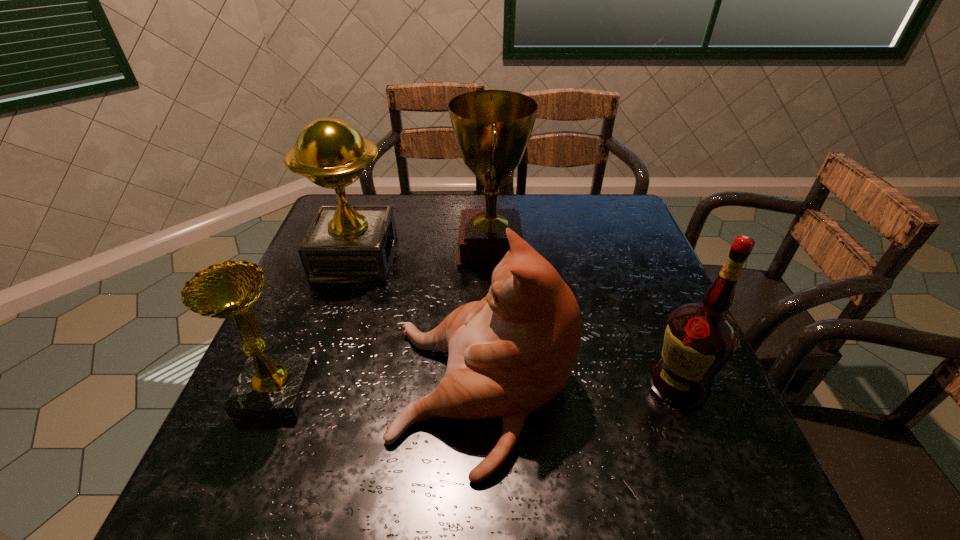
Locate an element on the screen. Image resolution: width=960 pixels, height=540 pixels. free space located on the label of the alcohol is located at coordinates (450, 384).

This screenshot has height=540, width=960. Find the location of `free space located on the face of the cat`. free space located on the face of the cat is located at coordinates (260, 395).

I want to click on vacant space located on the face of the cat, so click(291, 395).

You are a GUI agent. You are given a task and a screenshot of the screen. Output one action in this format:
    pyautogui.click(x=<x>, y=<y>)
    Task: Click on the free space located on the face of the cat
    This screenshot has height=540, width=960.
    Given the screenshot: What is the action you would take?
    246,395

The image size is (960, 540). In order to click on blank area located on the front-facing side of the shortest award in this screenshot , I will do `click(468, 392)`.

You are a GUI agent. You are given a task and a screenshot of the screen. Output one action in this format:
    pyautogui.click(x=<x>, y=<y>)
    Task: Click on the object located at the near edge
    
    Given the screenshot: What is the action you would take?
    pyautogui.click(x=512, y=352)

At what (x,y) coordinates should I click in order to perform the action: click on object at the right edge. Please return your answer as a coordinate pair (x, y). Looking at the image, I should click on (700, 338).

At what (x,y) coordinates should I click in order to perform the action: click on object present at the far left corner. Please return your answer as a coordinate pair (x, y). This screenshot has width=960, height=540. Looking at the image, I should click on (345, 243).

This screenshot has height=540, width=960. What are the coordinates of `vacant space at the far edge of the desktop` in the screenshot? It's located at (564, 233).

In the image, there is a desktop. What are the coordinates of `vacant space at the near edge` in the screenshot? It's located at (623, 480).